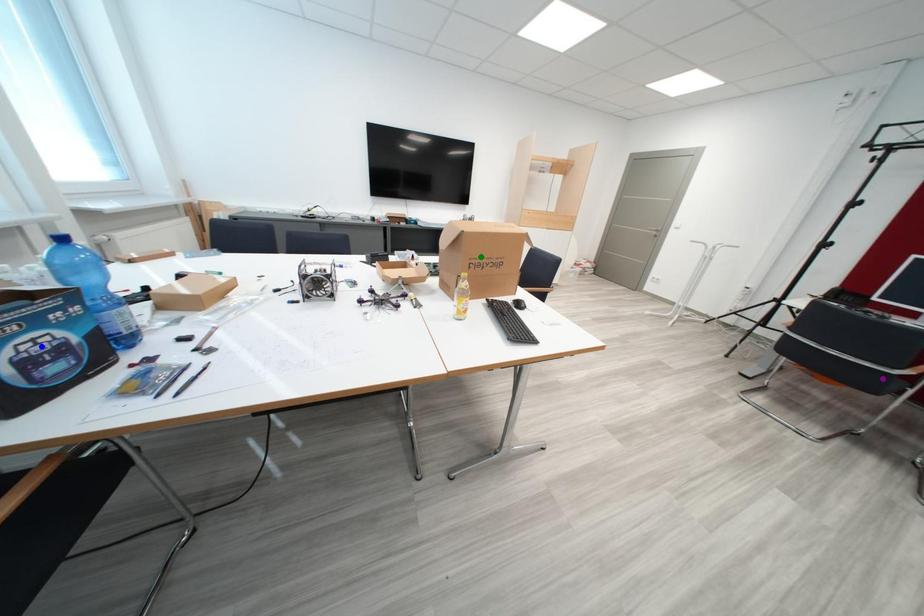
Order these from nearest to farthest:
A) purple point
B) green point
C) blue point

1. blue point
2. green point
3. purple point